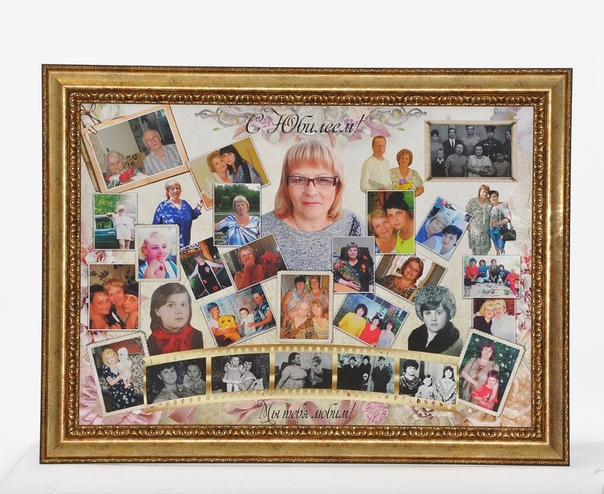
Locate an element on the screen. The height and width of the screenshot is (494, 604). black and white photos is located at coordinates (179, 370), (233, 365), (298, 365), (356, 361), (393, 372), (443, 375), (446, 310), (493, 139).